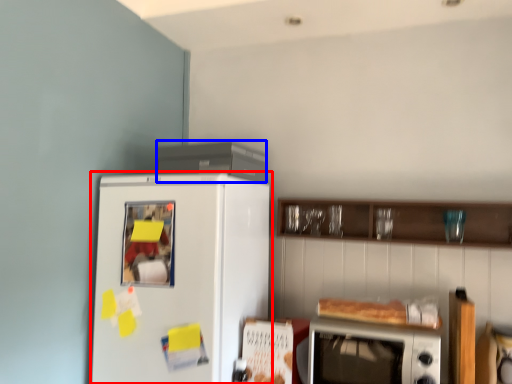
Question: Which object appears closest to the camera in this image, refrigerator (highlighted by a red box) or appliance (highlighted by a blue box)?

Choices:
 (A) refrigerator
 (B) appliance

Answer: (A)